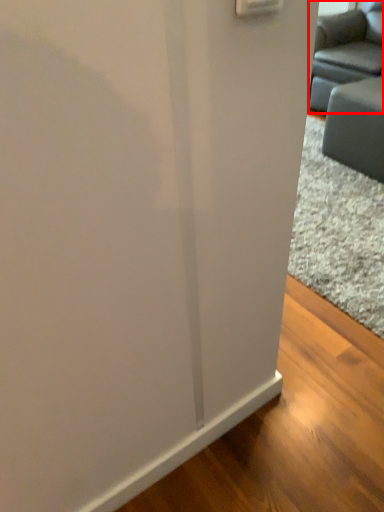
Question: Considering the relative positions of studio couch (annotated by the red box) and furniture in the image provided, where is studio couch (annotated by the red box) located with respect to the staircase?

Choices:
 (A) left
 (B) right

Answer: (B)